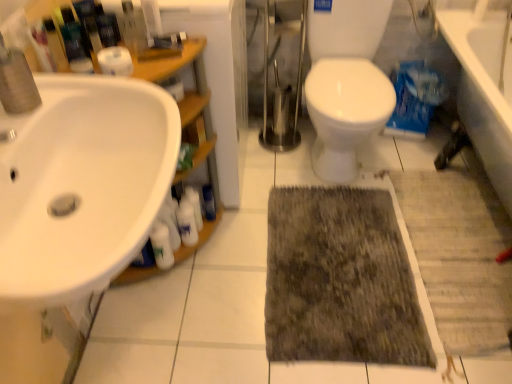
Locate an element on the screen. This screenshot has width=512, height=384. free spot to the left of dark gray shaggy rug at center is located at coordinates (209, 288).